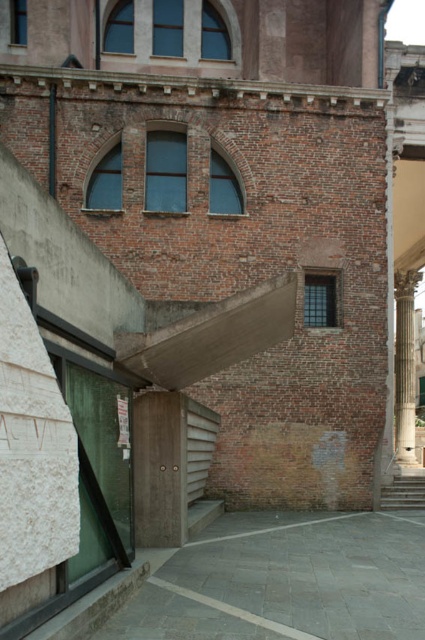
You are an architect assessing the building structure. You need to determine if the white marble column at right can fit through an opening designed for the wooden stairs at lower right. Based on their widths, can the column pass through the opening intended for the stairs?

The white marble column at right is wider than the wooden stairs at lower right. Therefore, the column cannot pass through the opening designed for the stairs since it is wider than the stairs themselves.

You are a delivery person carrying a package that is 5 feet wide. You need to navigate between the white marble column at right and the wooden stairs at lower right. Can you pass through the space between them without tilting the package?

The distance between the white marble column at right and the wooden stairs at lower right is 55.56 feet, which is much wider than the 5 feet width of the package. Therefore, you can easily pass through the space between them without tilting the package.

Looking at this image, you are standing in front of the building and want to determine the relative positions of two points marked on its facade. The points are labeled as point 1 at coordinates point (405, 424) and point 2 at coordinates point (393, 481). Which point is closer to you?

Point (405, 424) is further to the viewer than point (393, 481), so point (393, 481) is closer to you.